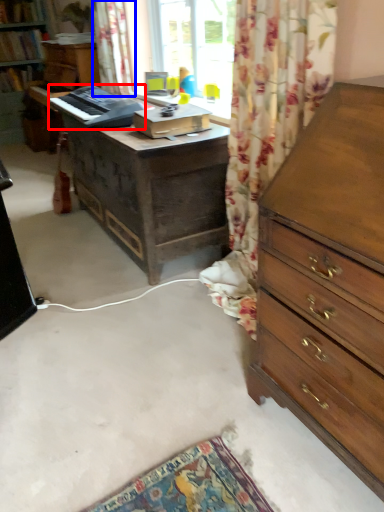
Question: Which of the following is the closest to the observer, equipment (highlighted by a red box) or curtain (highlighted by a blue box)?

Choices:
 (A) equipment
 (B) curtain

Answer: (A)